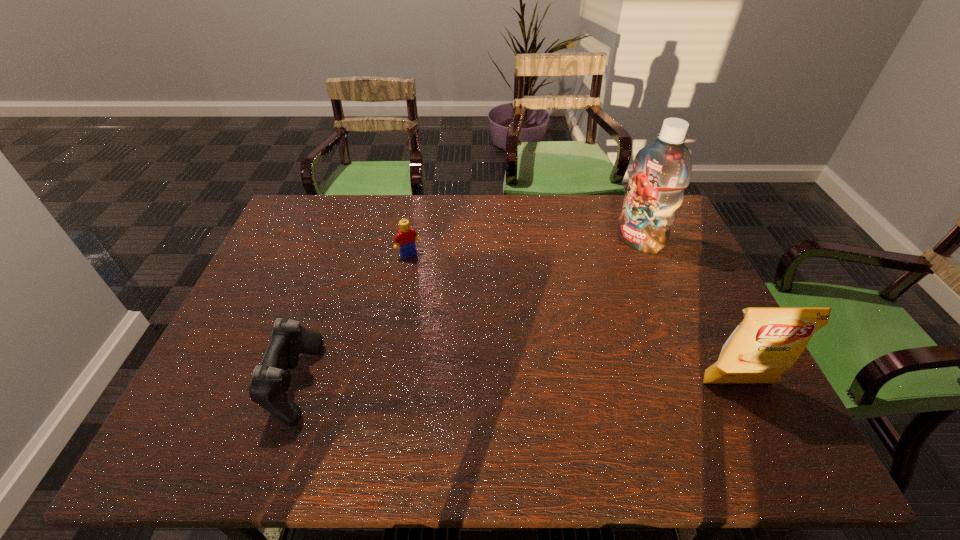
Locate an element on the screen. free spot on the desktop that is between the control and the third shortest object and is positioned on the front label of the tallest object is located at coordinates click(x=458, y=383).

The height and width of the screenshot is (540, 960). Identify the location of free space on the desktop that is between the control and the third shortest object and is positioned on the face of the Lego. (502, 383).